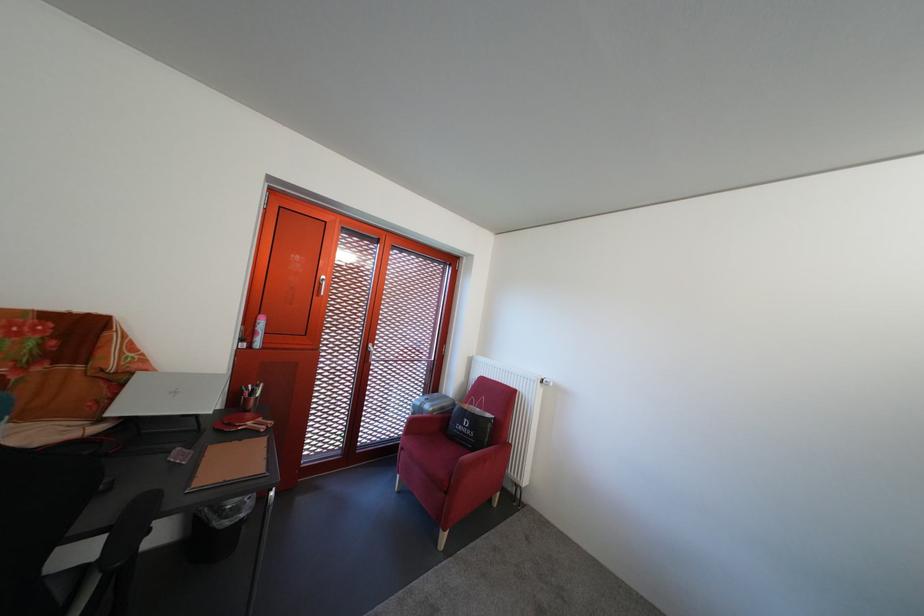
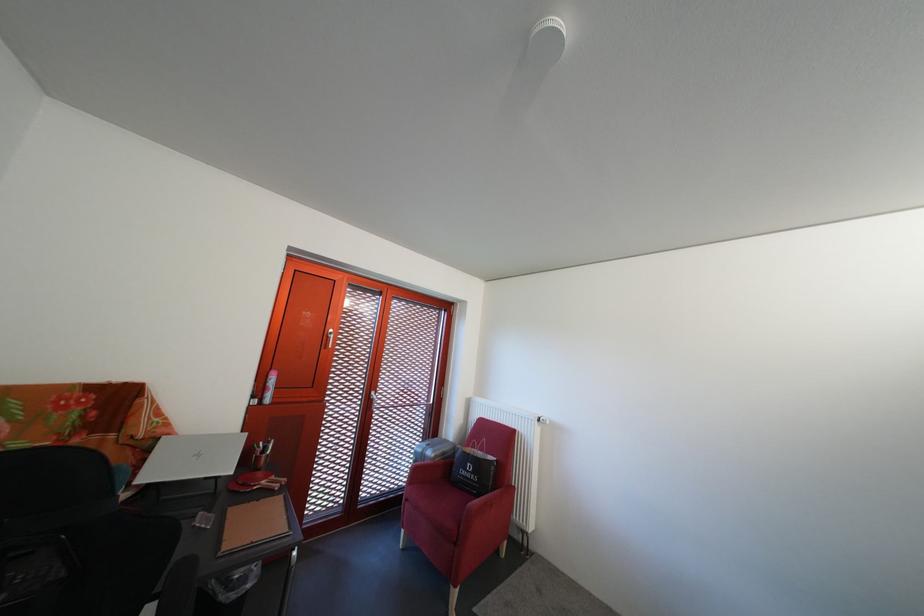
Where in the second image is the point corresponding to the point at 551,397 from the first image?

(549, 436)